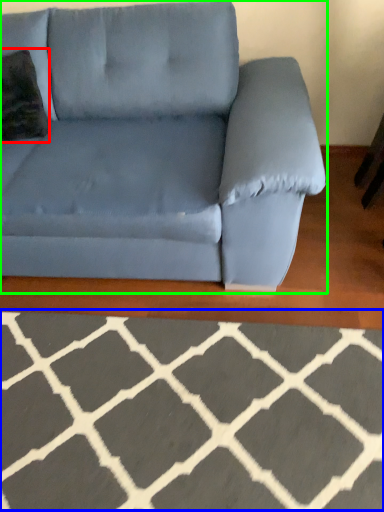
Question: Estimate the real-world distances between objects in this image. Which object is closer to throw pillow (highlighted by a red box), furniture (highlighted by a blue box) or studio couch (highlighted by a green box)?

Choices:
 (A) furniture
 (B) studio couch

Answer: (B)